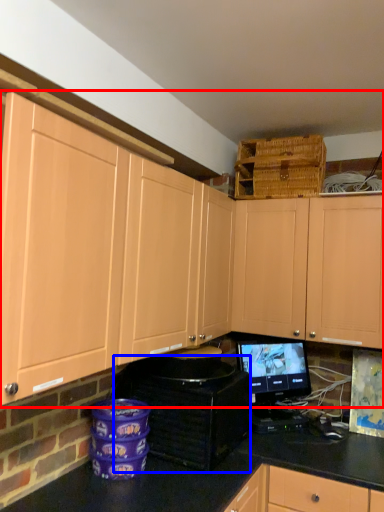
Question: Among these objects, which one is nearest to the camera, cabinetry (highlighted by a red box) or appliance (highlighted by a blue box)?

Choices:
 (A) cabinetry
 (B) appliance

Answer: (A)